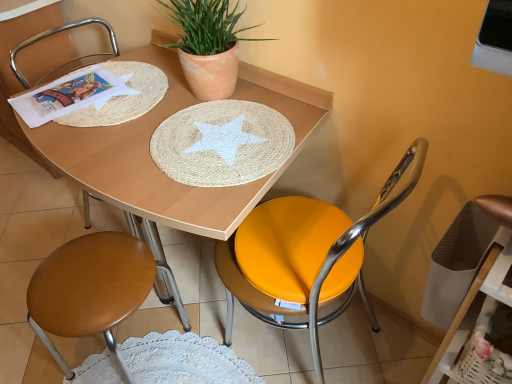
The width and height of the screenshot is (512, 384). What do you see at coordinates (53, 34) in the screenshot?
I see `brown leather stool at lower left, arranged as the first chair when viewed from the left` at bounding box center [53, 34].

What do you see at coordinates (94, 289) in the screenshot? I see `brown leather stool at lower left, the 2th chair viewed from the right` at bounding box center [94, 289].

Locate an element on the screen. metallic silver armchair at left is located at coordinates (53, 34).

Looking at this image, what is the approximate width of metallic yellow seat at center, which ranks as the third chair in left-to-right order?

17.94 inches.

The width and height of the screenshot is (512, 384). What do you see at coordinates (208, 45) in the screenshot?
I see `matte terracotta pot at upper center` at bounding box center [208, 45].

Find the location of `brown leather stool at lower left, arranged as the first chair when viewed from the left`. brown leather stool at lower left, arranged as the first chair when viewed from the left is located at coordinates (53, 34).

Considering the sizes of brown leather stool at lower left, which is counted as the 3th chair, starting from the right, and metallic silver armchair at left in the image, is brown leather stool at lower left, which is counted as the 3th chair, starting from the right, taller or shorter than metallic silver armchair at left?

Considering their sizes, brown leather stool at lower left, which is counted as the 3th chair, starting from the right, has less height than metallic silver armchair at left.

Can you tell me how much brown leather stool at lower left, arranged as the first chair when viewed from the left, and metallic silver armchair at left differ in facing direction?

There is a 85.6-degree angle between the facing directions of brown leather stool at lower left, arranged as the first chair when viewed from the left, and metallic silver armchair at left.

From the image's perspective, is brown leather stool at lower left, which is counted as the 3th chair, starting from the right, on top of metallic silver armchair at left?

No, from the image's perspective, brown leather stool at lower left, which is counted as the 3th chair, starting from the right, is not over metallic silver armchair at left.

Considering the relative sizes of brown leather stool at lower left, arranged as the first chair when viewed from the left, and metallic silver armchair at left in the image provided, is brown leather stool at lower left, arranged as the first chair when viewed from the left, smaller than metallic silver armchair at left?

Yes, brown leather stool at lower left, arranged as the first chair when viewed from the left, is smaller than metallic silver armchair at left.

Does metallic gold swivel chair at right turn towards metallic yellow seat at center, which ranks as the third chair in left-to-right order?

No, metallic gold swivel chair at right is not aimed at metallic yellow seat at center, which ranks as the third chair in left-to-right order.

Does metallic gold swivel chair at right have a greater width compared to metallic yellow seat at center, positioned as the 1th chair in right-to-left order?

No, metallic gold swivel chair at right is not wider than metallic yellow seat at center, positioned as the 1th chair in right-to-left order.

Considering the positions of point (504, 281) and point (312, 234), is point (504, 281) closer or farther from the camera than point (312, 234)?

Point (504, 281).

From a real-world perspective, is metallic gold swivel chair at right located beneath metallic yellow seat at center, which ranks as the third chair in left-to-right order?

Correct, in the physical world, metallic gold swivel chair at right is lower than metallic yellow seat at center, which ranks as the third chair in left-to-right order.

Considering the relative sizes of brown leather stool at lower left, positioned as the second chair in left-to-right order, and metallic yellow seat at center, which ranks as the third chair in left-to-right order, in the image provided, is brown leather stool at lower left, positioned as the second chair in left-to-right order, taller than metallic yellow seat at center, which ranks as the third chair in left-to-right order,?

No, brown leather stool at lower left, positioned as the second chair in left-to-right order, is not taller than metallic yellow seat at center, which ranks as the third chair in left-to-right order.

The width and height of the screenshot is (512, 384). Find the location of `chair on the right of brown leather stool at lower left, positioned as the second chair in left-to-right order`. chair on the right of brown leather stool at lower left, positioned as the second chair in left-to-right order is located at coordinates (305, 254).

From a real-world perspective, is brown leather stool at lower left, the 2th chair viewed from the right, physically below metallic yellow seat at center, which ranks as the third chair in left-to-right order?

Yes, from a real-world perspective, brown leather stool at lower left, the 2th chair viewed from the right, is under metallic yellow seat at center, which ranks as the third chair in left-to-right order.

Would you say metallic yellow seat at center, positioned as the 1th chair in right-to-left order, is part of brown leather stool at lower left, positioned as the second chair in left-to-right order,'s contents?

That's incorrect, metallic yellow seat at center, positioned as the 1th chair in right-to-left order, is not inside brown leather stool at lower left, positioned as the second chair in left-to-right order.

Do you think metallic gold swivel chair at right is within metallic silver armchair at left, or outside of it?

metallic gold swivel chair at right exists outside the volume of metallic silver armchair at left.

From a real-world perspective, which object rests below the other?

From a 3D spatial view, metallic gold swivel chair at right is below.

Considering the sizes of metallic gold swivel chair at right and metallic silver armchair at left in the image, is metallic gold swivel chair at right wider or thinner than metallic silver armchair at left?

Considering their sizes, metallic gold swivel chair at right looks slimmer than metallic silver armchair at left.

Would you say metallic gold swivel chair at right is to the left or to the right of metallic silver armchair at left in the picture?

Clearly, metallic gold swivel chair at right is on the right of metallic silver armchair at left in the image.

From the image's perspective, who appears lower, metallic yellow seat at center, positioned as the 1th chair in right-to-left order, or metallic gold swivel chair at right?

metallic gold swivel chair at right is shown below in the image.

Which is correct: metallic yellow seat at center, positioned as the 1th chair in right-to-left order, is inside metallic gold swivel chair at right, or outside of it?

metallic yellow seat at center, positioned as the 1th chair in right-to-left order, is not inside metallic gold swivel chair at right, it's outside.

Could you tell me if metallic yellow seat at center, positioned as the 1th chair in right-to-left order, is facing metallic gold swivel chair at right?

No.

Measure the distance between metallic yellow seat at center, which ranks as the third chair in left-to-right order, and metallic gold swivel chair at right.

A distance of 29.95 centimeters exists between metallic yellow seat at center, which ranks as the third chair in left-to-right order, and metallic gold swivel chair at right.

How much distance is there between metallic yellow seat at center, which ranks as the third chair in left-to-right order, and brown leather stool at lower left, which is counted as the 3th chair, starting from the right?

A distance of 3.81 feet exists between metallic yellow seat at center, which ranks as the third chair in left-to-right order, and brown leather stool at lower left, which is counted as the 3th chair, starting from the right.

From a real-world perspective, is metallic yellow seat at center, which ranks as the third chair in left-to-right order, below brown leather stool at lower left, which is counted as the 3th chair, starting from the right?

Yes, from a real-world perspective, metallic yellow seat at center, which ranks as the third chair in left-to-right order, is beneath brown leather stool at lower left, which is counted as the 3th chair, starting from the right.

Which is in front, point (399, 170) or point (27, 41)?

Positioned in front is point (399, 170).

What's the angular difference between metallic yellow seat at center, which ranks as the third chair in left-to-right order, and brown leather stool at lower left, which is counted as the 3th chair, starting from the right,'s facing directions?

The angle between the facing direction of metallic yellow seat at center, which ranks as the third chair in left-to-right order, and the facing direction of brown leather stool at lower left, which is counted as the 3th chair, starting from the right, is 176 degrees.

Considering the sizes of objects matte terracotta pot at upper center and metallic silver armchair at left in the image provided, who is bigger, matte terracotta pot at upper center or metallic silver armchair at left?

Bigger between the two is metallic silver armchair at left.

Considering the positions of point (181, 54) and point (132, 225), is point (181, 54) closer or farther from the camera than point (132, 225)?

Point (181, 54) is positioned closer to the camera compared to point (132, 225).

Is matte terracotta pot at upper center positioned beyond the bounds of metallic silver armchair at left?

That's correct, matte terracotta pot at upper center is outside of metallic silver armchair at left.

Is the depth of matte terracotta pot at upper center greater than that of metallic silver armchair at left?

No, it is not.

Locate an element on the screen. Image resolution: width=512 pixels, height=384 pixels. chair that is the 1st one when counting forward from the metallic silver armchair at left is located at coordinates (53, 34).

Locate an element on the screen. swivel chair below the metallic yellow seat at center, positioned as the 1th chair in right-to-left order (from a real-world perspective) is located at coordinates (472, 288).

When comparing their distances from brown leather stool at lower left, which is counted as the 3th chair, starting from the right, does metallic silver armchair at left or matte terracotta pot at upper center seem further?

Among the two, matte terracotta pot at upper center is located further to brown leather stool at lower left, which is counted as the 3th chair, starting from the right.

Looking at the image, which one is located closer to metallic yellow seat at center, which ranks as the third chair in left-to-right order, brown leather stool at lower left, the 2th chair viewed from the right, or matte terracotta pot at upper center?

Among the two, brown leather stool at lower left, the 2th chair viewed from the right, is located nearer to metallic yellow seat at center, which ranks as the third chair in left-to-right order.

Which object lies further to the anchor point metallic yellow seat at center, positioned as the 1th chair in right-to-left order, brown leather stool at lower left, positioned as the second chair in left-to-right order, or matte wood table at center?

brown leather stool at lower left, positioned as the second chair in left-to-right order, is further to metallic yellow seat at center, positioned as the 1th chair in right-to-left order.

Based on their spatial positions, is matte wood table at center or metallic yellow seat at center, which ranks as the third chair in left-to-right order, further from brown leather stool at lower left, the 2th chair viewed from the right?

Among the two, metallic yellow seat at center, which ranks as the third chair in left-to-right order, is located further to brown leather stool at lower left, the 2th chair viewed from the right.

From the image, which object appears to be farther from metallic gold swivel chair at right, metallic silver armchair at left or matte terracotta pot at upper center?

metallic silver armchair at left.

Estimate the real-world distances between objects in this image. Which object is closer to matte wood table at center, metallic silver armchair at left or brown leather stool at lower left, which is counted as the 3th chair, starting from the right?

metallic silver armchair at left.

From the image, which object appears to be nearer to metallic yellow seat at center, which ranks as the third chair in left-to-right order, metallic gold swivel chair at right or brown leather stool at lower left, arranged as the first chair when viewed from the left?

The object closer to metallic yellow seat at center, which ranks as the third chair in left-to-right order, is metallic gold swivel chair at right.

When comparing their distances from brown leather stool at lower left, which is counted as the 3th chair, starting from the right, does matte terracotta pot at upper center or brown leather stool at lower left, the 2th chair viewed from the right, seem closer?

Based on the image, matte terracotta pot at upper center appears to be nearer to brown leather stool at lower left, which is counted as the 3th chair, starting from the right.

Image resolution: width=512 pixels, height=384 pixels. I want to click on round table between brown leather stool at lower left, positioned as the second chair in left-to-right order, and metallic yellow seat at center, which ranks as the third chair in left-to-right order, in the horizontal direction, so click(x=154, y=163).

Image resolution: width=512 pixels, height=384 pixels. Find the location of `houseplant situated between metallic silver armchair at left and metallic yellow seat at center, positioned as the 1th chair in right-to-left order, from left to right`. houseplant situated between metallic silver armchair at left and metallic yellow seat at center, positioned as the 1th chair in right-to-left order, from left to right is located at coordinates (208, 45).

Locate an element on the screen. chair located between brown leather stool at lower left, which is counted as the 3th chair, starting from the right, and metallic yellow seat at center, which ranks as the third chair in left-to-right order, in the left-right direction is located at coordinates (94, 289).

You are a GUI agent. You are given a task and a screenshot of the screen. Output one action in this format:
    pyautogui.click(x=<x>, y=<y>)
    Task: Click on the round table located between brown leather stool at lower left, which is counted as the 3th chair, starting from the right, and metallic gold swivel chair at right in the left-right direction
    Image resolution: width=512 pixels, height=384 pixels.
    Given the screenshot: What is the action you would take?
    pyautogui.click(x=154, y=163)